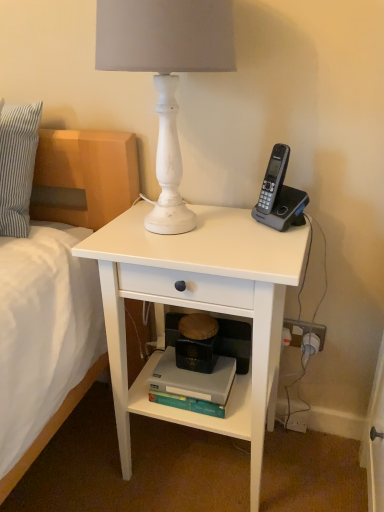
This screenshot has height=512, width=384. Identify the location of free space above white matte desk at center (from a real-world perspective). (184, 229).